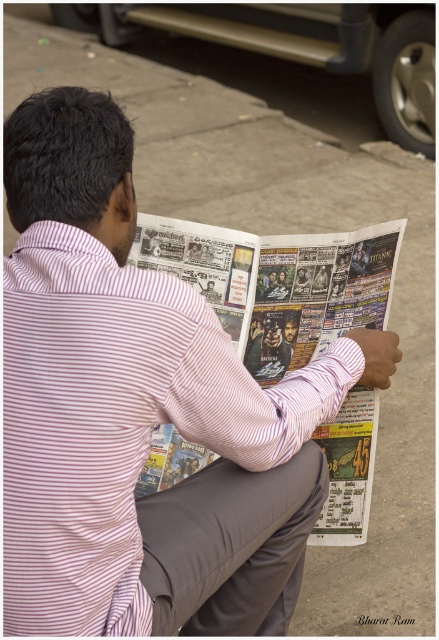
Question: Does printed newspaper at center lie in front of gray cotton pants at lower center?

Choices:
 (A) yes
 (B) no

Answer: (B)

Question: Which point appears closest to the camera in this image?

Choices:
 (A) (301, 502)
 (B) (291, 321)

Answer: (A)

Question: Is printed newspaper at center to the left of gray cotton pants at lower center from the viewer's perspective?

Choices:
 (A) yes
 (B) no

Answer: (B)

Question: Which point is closer to the camera taking this photo?

Choices:
 (A) (148, 253)
 (B) (177, 592)

Answer: (B)

Question: Is printed newspaper at center to the right of gray cotton pants at lower center from the viewer's perspective?

Choices:
 (A) no
 (B) yes

Answer: (B)

Question: Which of the following is the farthest from the observer?

Choices:
 (A) printed newspaper at center
 (B) gray cotton pants at lower center

Answer: (A)